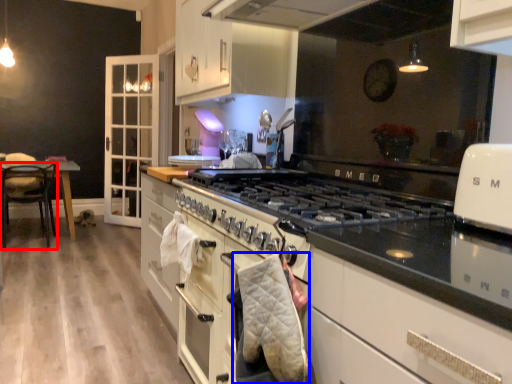
Question: Which object is further to the camera taking this photo, chair (highlighted by a red box) or blanket (highlighted by a blue box)?

Choices:
 (A) chair
 (B) blanket

Answer: (A)